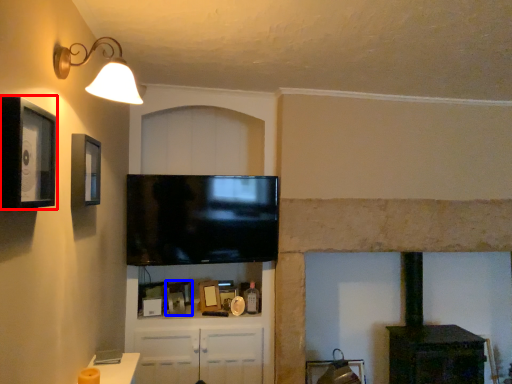
Question: Which of the following is the closest to the observer, picture frame (highlighted by a red box) or picture frame (highlighted by a blue box)?

Choices:
 (A) picture frame
 (B) picture frame

Answer: (A)